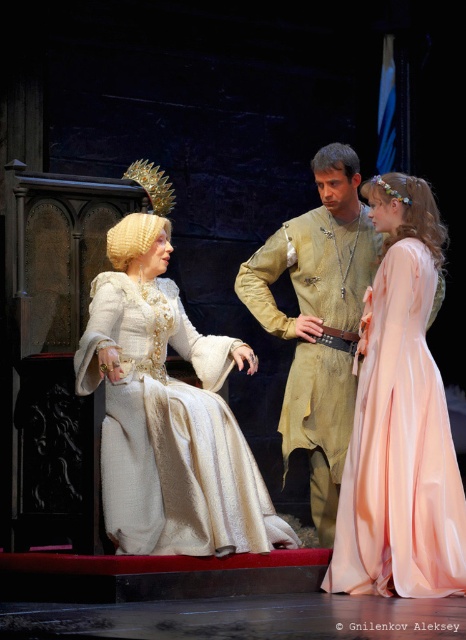
Question: Is white satin dress at center further to camera compared to golden silk tunic at center?

Choices:
 (A) yes
 (B) no

Answer: (A)

Question: Among these points, which one is farthest from the camera?

Choices:
 (A) (149, 484)
 (B) (331, 500)

Answer: (B)

Question: Among these points, which one is farthest from the camera?

Choices:
 (A) (348, 269)
 (B) (275, 524)
 (C) (405, 497)

Answer: (A)

Question: Is pale pink satin dress at right to the right of golden silk tunic at center from the viewer's perspective?

Choices:
 (A) yes
 (B) no

Answer: (A)

Question: Which point is farther to the camera?

Choices:
 (A) (130, 323)
 (B) (338, 184)
 (C) (456, 516)

Answer: (B)

Question: Is white satin dress at center above golden silk tunic at center?

Choices:
 (A) yes
 (B) no

Answer: (B)